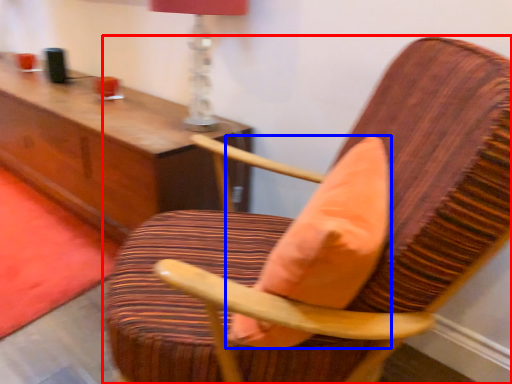
Question: Which object is further to the camera taking this photo, chair (highlighted by a red box) or throw pillow (highlighted by a blue box)?

Choices:
 (A) chair
 (B) throw pillow

Answer: (B)